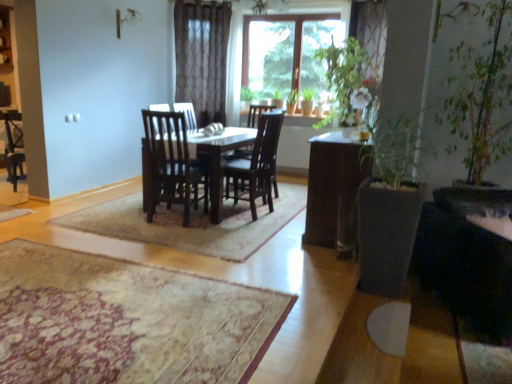
Find the location of a particular element. This screenshot has width=512, height=384. vacant space behind beige textured rug at center is located at coordinates (150, 242).